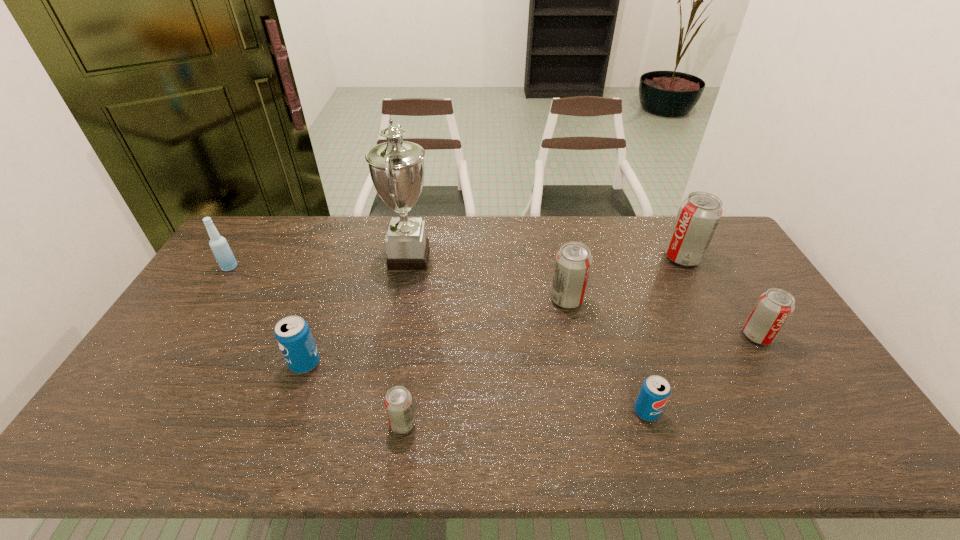
I want to click on the nearer blue soda can, so click(655, 391).

This screenshot has height=540, width=960. I want to click on the right blue soda can, so click(x=655, y=391).

Where is `the leftmost gray soda can`? Image resolution: width=960 pixels, height=540 pixels. the leftmost gray soda can is located at coordinates (398, 403).

Locate an element on the screen. This screenshot has height=540, width=960. the smallest gray soda can is located at coordinates (398, 403).

The height and width of the screenshot is (540, 960). Find the location of `free space located at the front view of the tallest object`. free space located at the front view of the tallest object is located at coordinates (515, 258).

Where is `free region located on the back of the biggest gray soda can`? This screenshot has width=960, height=540. free region located on the back of the biggest gray soda can is located at coordinates (661, 218).

The width and height of the screenshot is (960, 540). Identify the location of vacant space situated on the back of the leftmost object. pyautogui.click(x=247, y=241).

This screenshot has height=540, width=960. In order to click on vacant region located 0.250m on the left of the fifth nearest soda can in this screenshot , I will do `click(470, 299)`.

Image resolution: width=960 pixels, height=540 pixels. In order to click on vacant position located 0.400m on the back of the fourth nearest soda can in this screenshot , I will do `click(701, 242)`.

The height and width of the screenshot is (540, 960). I want to click on vacant space located on the back of the bigger blue soda can, so click(x=337, y=275).